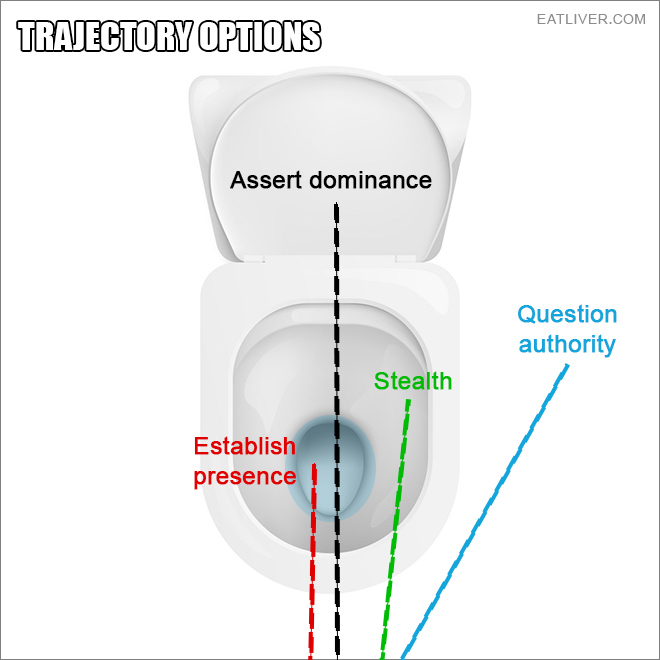
At what (x,y) coordinates should I click in order to perform the action: click on toilet. Please return your answer as a coordinate pair (x, y). This screenshot has width=660, height=660. Looking at the image, I should click on (290, 319).